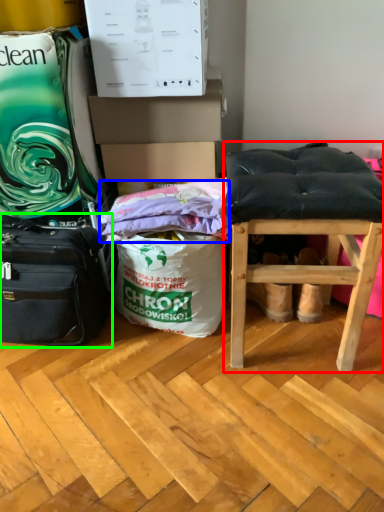
Question: Estimate the real-world distances between objects in this image. Which object is closer to stool (highlighted by a red box), material (highlighted by a blue box) or luggage and bags (highlighted by a green box)?

Choices:
 (A) material
 (B) luggage and bags

Answer: (A)